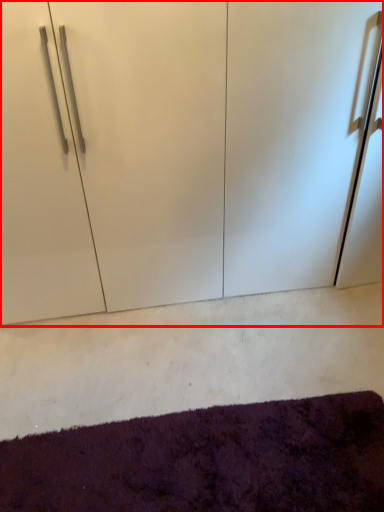
Question: From the image's perspective, where is cupboard (annotated by the red box) located relative to mat?

Choices:
 (A) above
 (B) below

Answer: (A)